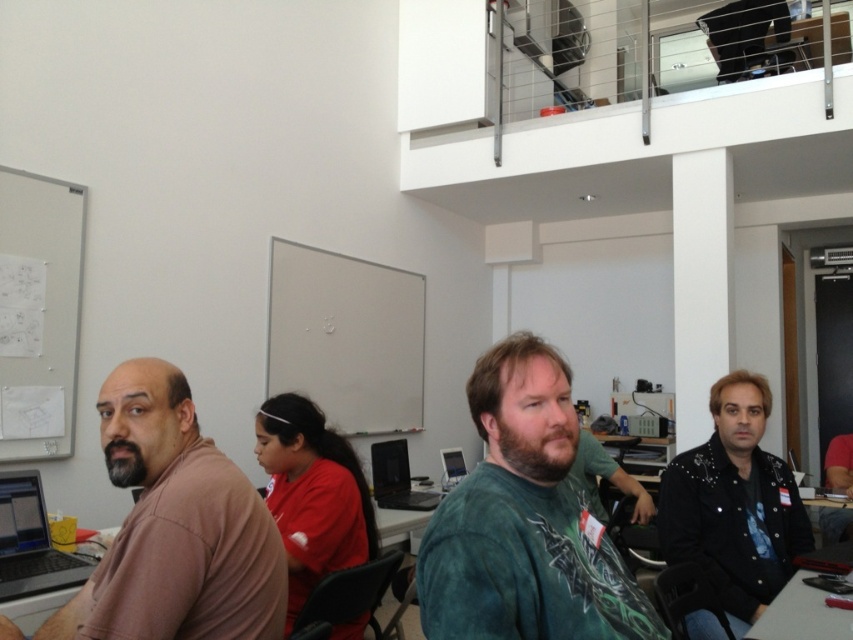
Question: Can you confirm if matte red shirt at center is positioned to the left of silver metallic laptop at left?

Choices:
 (A) yes
 (B) no

Answer: (B)

Question: Among these objects, which one is farthest from the camera?

Choices:
 (A) teal matte shirt at center
 (B) matte black monitor at center
 (C) matte red shirt at center

Answer: (B)

Question: Considering the relative positions of teal matte shirt at center and matte black monitor at center in the image provided, where is teal matte shirt at center located with respect to matte black monitor at center?

Choices:
 (A) right
 (B) left

Answer: (A)

Question: Which point is closer to the camera?

Choices:
 (A) (343, 632)
 (B) (447, 456)
 (C) (392, 468)

Answer: (A)

Question: Which of the following is the closest to the observer?

Choices:
 (A) matte black monitor at center
 (B) black plastic laptop at center
 (C) teal matte shirt at center

Answer: (C)

Question: Can you confirm if black studded leather jacket at lower right is wider than matte red shirt at center?

Choices:
 (A) no
 (B) yes

Answer: (B)